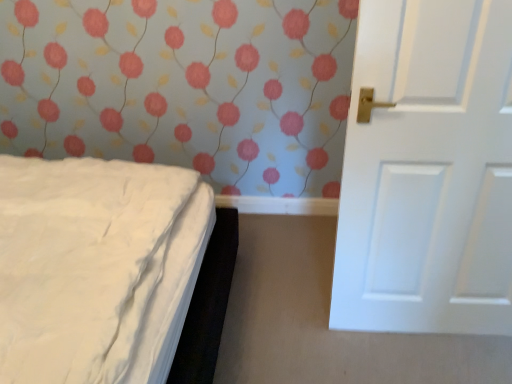
Locate an element on the screen. The width and height of the screenshot is (512, 384). white soft bed at left is located at coordinates (95, 266).

Looking at this image, what is the approximate width of white soft bed at left?

It is 4.65 feet.

Measure the distance between white soft bed at left and camera.

white soft bed at left and camera are 37.91 inches apart.

Describe the element at coordinates (95, 266) in the screenshot. I see `white soft bed at left` at that location.

Describe the element at coordinates (428, 172) in the screenshot. I see `white matte door at right` at that location.

Find the location of a particular element. The image size is (512, 384). white matte door at right is located at coordinates (428, 172).

Measure the distance between white matte door at right and camera.

A distance of 1.21 meters exists between white matte door at right and camera.

The image size is (512, 384). In order to click on white soft bed at left in this screenshot , I will do `click(95, 266)`.

Which is more to the left, white soft bed at left or white matte door at right?

From the viewer's perspective, white soft bed at left appears more on the left side.

Is white soft bed at left positioned before white matte door at right?

Yes, it is in front of white matte door at right.

Is point (74, 178) less distant than point (502, 318)?

No, (74, 178) is behind (502, 318).

From the image's perspective, which object appears higher, white soft bed at left or white matte door at right?

white matte door at right appears higher in the image.

Based on the photo, from a real-world perspective, who is located higher, white soft bed at left or white matte door at right?

white soft bed at left, from a real-world perspective.

Which of these two, white soft bed at left or white matte door at right, is wider?

Wider between the two is white soft bed at left.

Considering the sizes of objects white soft bed at left and white matte door at right in the image provided, who is taller, white soft bed at left or white matte door at right?

With more height is white soft bed at left.

Is white soft bed at left bigger than white matte door at right?

Correct, white soft bed at left is larger in size than white matte door at right.

Can we say white soft bed at left lies outside white matte door at right?

Yes.

From the picture: Is the surface of white soft bed at left in direct contact with white matte door at right?

white soft bed at left and white matte door at right are not in contact.

Could you tell me if white soft bed at left is facing white matte door at right?

Yes, white soft bed at left is aimed at white matte door at right.

Identify the location of door on the right of white soft bed at left. The width and height of the screenshot is (512, 384). [428, 172].

Which object is positioned more to the right, white matte door at right or white soft bed at left?

white matte door at right.

Considering the positions of objects white matte door at right and white soft bed at left in the image provided, who is in front, white matte door at right or white soft bed at left?

white soft bed at left.

Considering the points (377, 180) and (176, 233), which point is behind, point (377, 180) or point (176, 233)?

The point (176, 233) is more distant.

From the image's perspective, would you say white matte door at right is shown under white soft bed at left?

No, from the image's perspective, white matte door at right is not below white soft bed at left.

From a real-world perspective, between white matte door at right and white soft bed at left, who is vertically lower?

white matte door at right, from a real-world perspective.

Is white matte door at right wider or thinner than white soft bed at left?

Considering their sizes, white matte door at right looks slimmer than white soft bed at left.

Can you confirm if white matte door at right is shorter than white soft bed at left?

Yes, white matte door at right is shorter than white soft bed at left.

Considering the sizes of objects white matte door at right and white soft bed at left in the image provided, who is bigger, white matte door at right or white soft bed at left?

With larger size is white soft bed at left.

Does white matte door at right contain white soft bed at left?

No.

Are white matte door at right and white soft bed at left beside each other?

No, white matte door at right is not making contact with white soft bed at left.

Is white matte door at right aimed at white soft bed at left?

No, white matte door at right is not facing towards white soft bed at left.

Where is `door above the white soft bed at left (from the image's perspective)`? door above the white soft bed at left (from the image's perspective) is located at coordinates (428, 172).

At what (x,y) coordinates should I click in order to perform the action: click on bed in front of the white matte door at right. Please return your answer as a coordinate pair (x, y). The width and height of the screenshot is (512, 384). Looking at the image, I should click on (95, 266).

Where is `door located on the right of white soft bed at left`? The width and height of the screenshot is (512, 384). door located on the right of white soft bed at left is located at coordinates (428, 172).